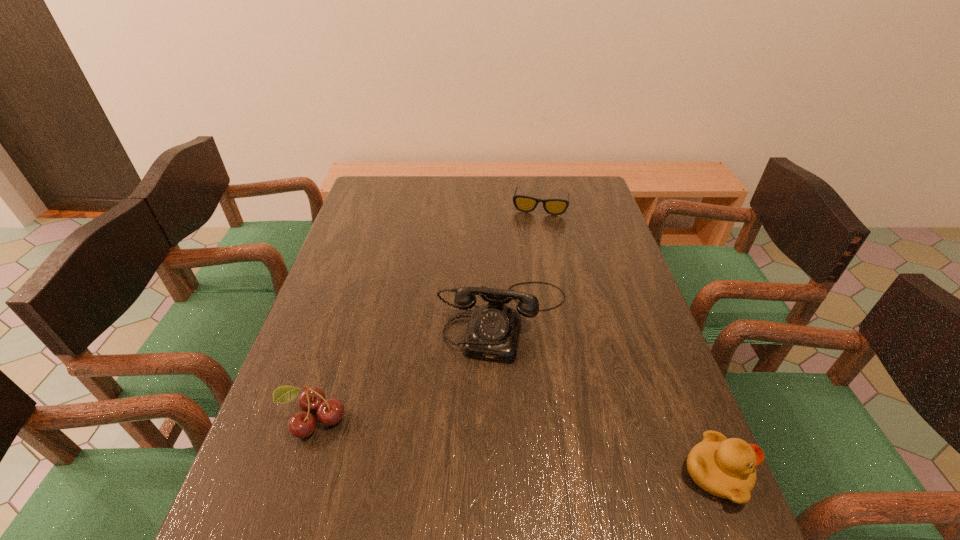
The height and width of the screenshot is (540, 960). I want to click on free area in between the duckling and the farthest object, so (628, 340).

You are a GUI agent. You are given a task and a screenshot of the screen. Output one action in this format:
    pyautogui.click(x=<x>, y=<y>)
    Task: Click on the vacant area between the sunglasses and the duckling
    The height and width of the screenshot is (540, 960).
    Given the screenshot: What is the action you would take?
    click(x=628, y=340)

You are a GUI agent. You are given a task and a screenshot of the screen. Output one action in this format:
    pyautogui.click(x=<x>, y=<y>)
    Task: Click on the vacant space that is in between the cherry and the third nearest object
    
    Given the screenshot: What is the action you would take?
    pyautogui.click(x=409, y=369)

In order to click on vacant area between the sunglasses and the telephone in this screenshot , I will do `click(522, 262)`.

This screenshot has width=960, height=540. I want to click on free space between the rightmost object and the telephone, so click(610, 397).

This screenshot has width=960, height=540. What are the coordinates of `object that ranks as the third closest to the rightmost object` in the screenshot? It's located at (522, 203).

Locate an element on the screen. This screenshot has width=960, height=540. object that is the second closest one to the rightmost object is located at coordinates (302, 424).

The image size is (960, 540). In order to click on vacant area in the image that satisfies the following two spatial constraints: 1. on the front side of the farthest object; 2. at the beak of the duckling in this screenshot , I will do `click(592, 475)`.

Locate an element on the screen. The height and width of the screenshot is (540, 960). vacant space that satisfies the following two spatial constraints: 1. on the back side of the farthest object; 2. on the right side of the telephone is located at coordinates (497, 206).